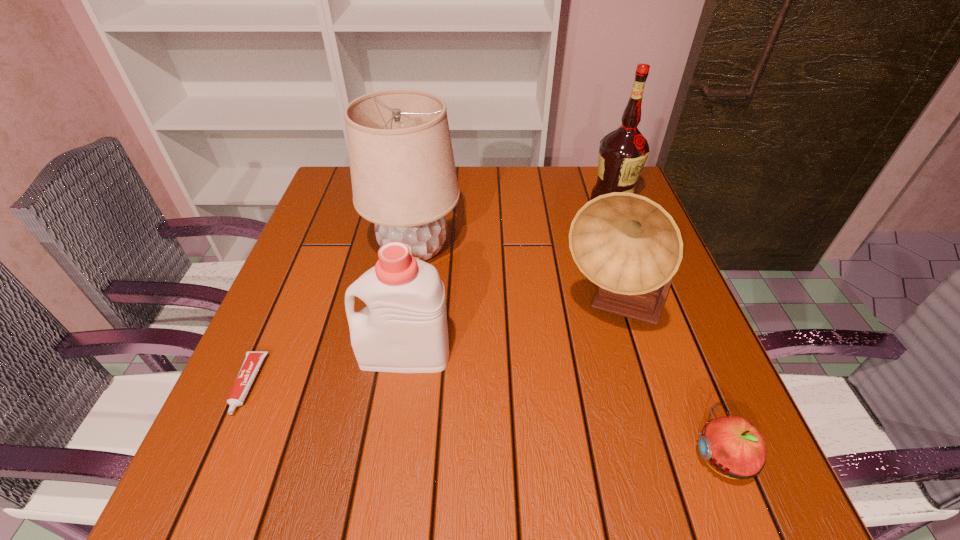
At what (x,y) coordinates should I click in order to perform the action: click on vacant position in the image that satisfies the following two spatial constraints: 1. on the handle side of the fourth tallest object; 2. at the nozzle of the leftmost object. Please return your answer as a coordinate pair (x, y). Looking at the image, I should click on (400, 384).